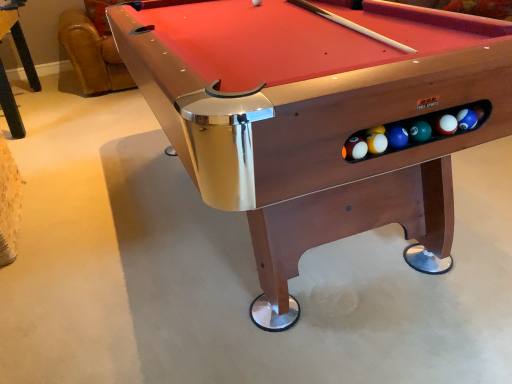
Question: Is point (336, 160) positioned closer to the camera than point (15, 1)?

Choices:
 (A) closer
 (B) farther

Answer: (A)

Question: Considering the relative positions of wooden billiard table at center and wooden pool table at lower left in the image provided, is wooden billiard table at center to the left or to the right of wooden pool table at lower left?

Choices:
 (A) left
 (B) right

Answer: (B)

Question: From a real-world perspective, is wooden billiard table at center above or below wooden pool table at lower left?

Choices:
 (A) below
 (B) above

Answer: (A)

Question: Is wooden pool table at lower left inside or outside of wooden billiard table at center?

Choices:
 (A) outside
 (B) inside

Answer: (A)

Question: Based on their positions, is wooden pool table at lower left located to the left or right of wooden billiard table at center?

Choices:
 (A) right
 (B) left

Answer: (B)

Question: Is wooden pool table at lower left wider or thinner than wooden billiard table at center?

Choices:
 (A) wide
 (B) thin

Answer: (B)

Question: Is point (12, 31) closer or farther from the camera than point (313, 44)?

Choices:
 (A) closer
 (B) farther

Answer: (B)